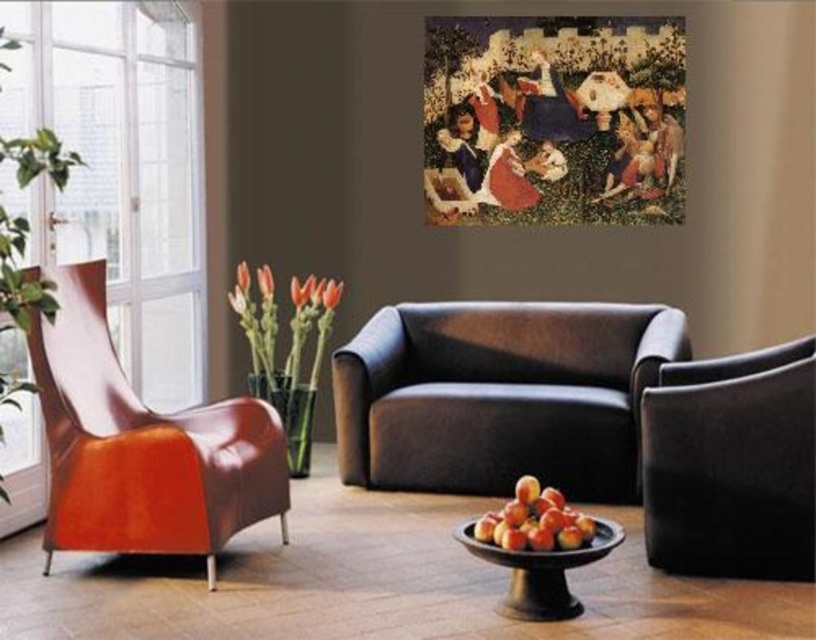
You are a guest entering the living room and want to place a small decorative item on the surface closest to you. Which object between the dark brown leather couch at center and the glossy wooden bowl of peaches at lower center should you choose?

The glossy wooden bowl of peaches at lower center is the lower object, so it is closer to you. Therefore, you should place the decorative item on the glossy wooden bowl of peaches at lower center.

You are standing in the living room and want to know how far you are from the point marked at coordinates (513, 449). Can you determine the distance?

The point marked at coordinates (513, 449) is 5.16 meters away from you.

You are planning to place a new decorative item on the floor in the living room. You want to place it exactly where the black glossy bowl at lower center is currently located. What are the coordinates of the spot where you should place your new item?

The coordinates for the black glossy bowl at lower center are at point [542,572]. So you should place your new item at those coordinates.